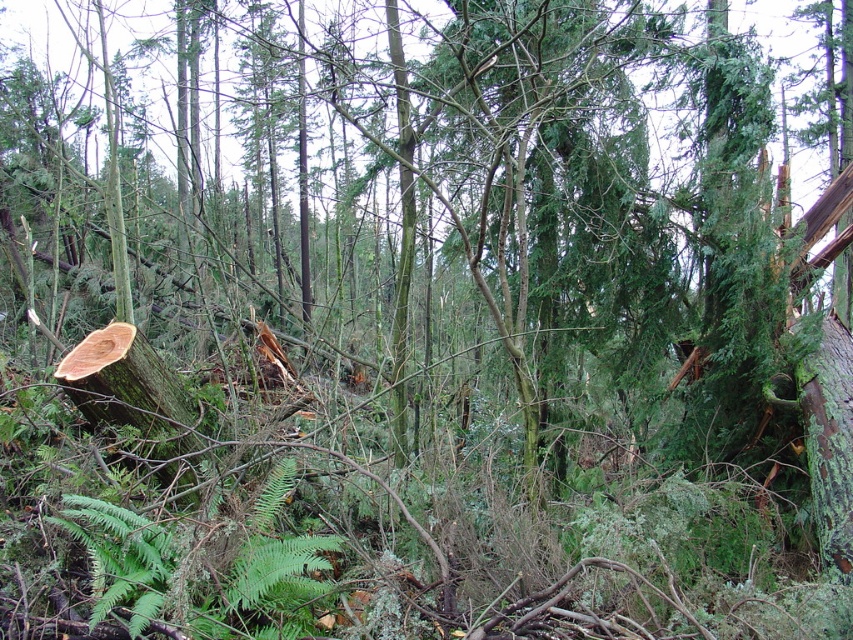
Does green fuzzy fern at center appear on the left side of green rough bark tree trunk at right?

Correct, you'll find green fuzzy fern at center to the left of green rough bark tree trunk at right.

Who is positioned more to the right, green fuzzy fern at center or green rough bark tree trunk at right?

Positioned to the right is green rough bark tree trunk at right.

Measure the distance between green fuzzy fern at center and camera.

They are 1.92 meters apart.

You are a GUI agent. You are given a task and a screenshot of the screen. Output one action in this format:
    pyautogui.click(x=<x>, y=<y>)
    Task: Click on the green fuzzy fern at center
    
    Given the screenshot: What is the action you would take?
    pyautogui.click(x=271, y=566)

Can you confirm if green fuzzy fern at center is positioned above green rough tree trunk at lower left?

No, green fuzzy fern at center is not above green rough tree trunk at lower left.

Locate an element on the screen. green fuzzy fern at center is located at coordinates (271, 566).

Find the location of a particular element. This screenshot has width=853, height=640. green fuzzy fern at center is located at coordinates (271, 566).

Between green rough tree trunk at lower left and green rough bark tree trunk at right, which one has more height?

With more height is green rough bark tree trunk at right.

Between point (173, 456) and point (840, 536), which one is positioned in front?

Point (840, 536) is more forward.

This screenshot has height=640, width=853. Identify the location of green rough tree trunk at lower left. (134, 396).